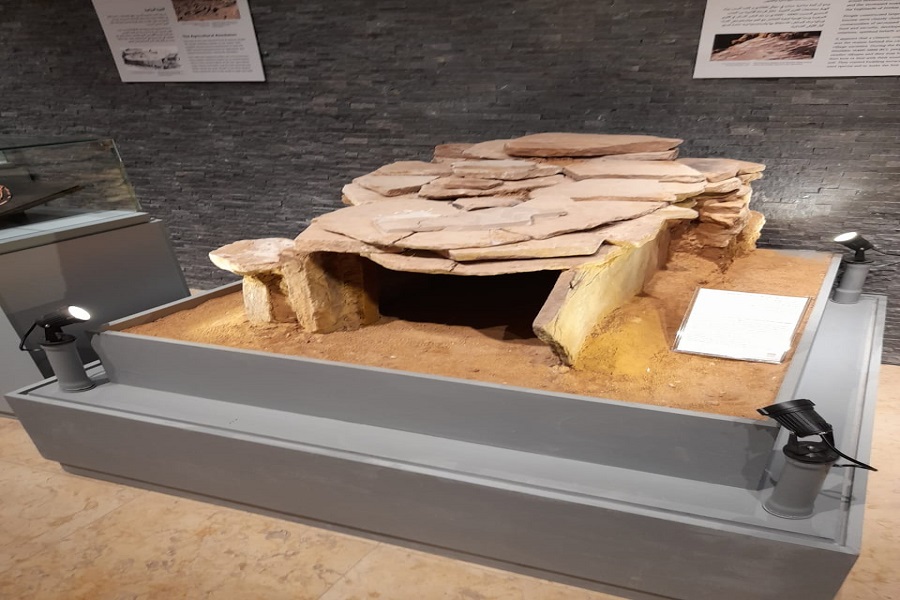
At what (x,y) coordinates should I click in order to perform the action: click on lights. Please return your answer as a coordinate pair (x, y). The height and width of the screenshot is (600, 900). Looking at the image, I should click on (850, 231), (801, 409), (67, 315).